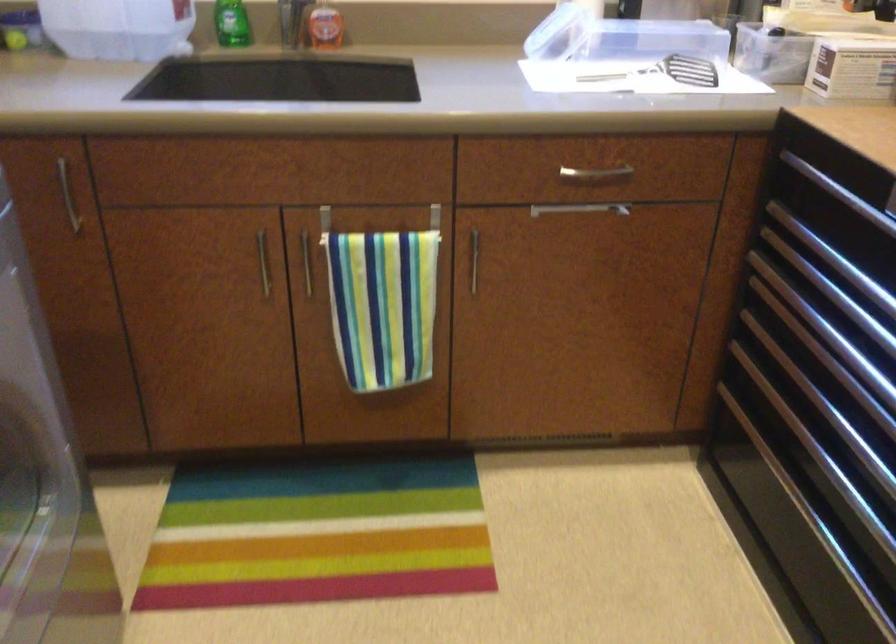
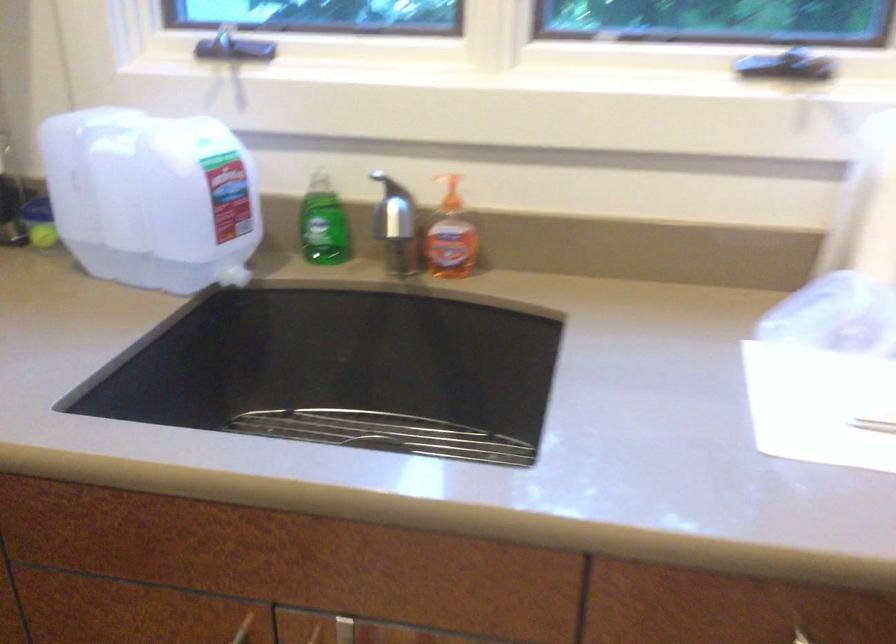
Find the pixel in the second image that matches (x=323, y=222) in the first image.

(343, 630)